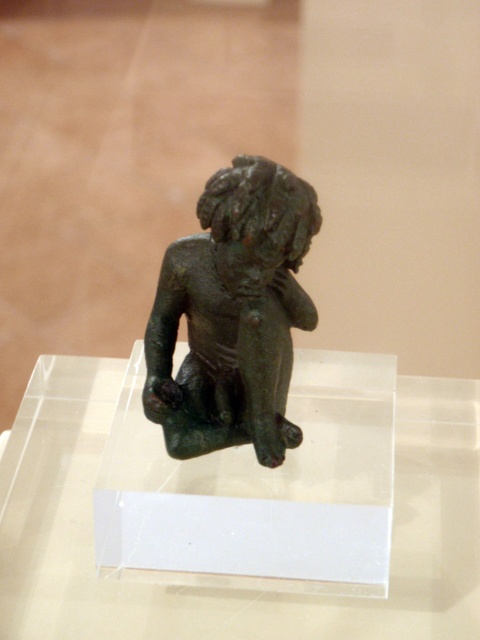
Is transparent acrylic glass table at center positioned in front of bronze statue at center?

No, it is behind bronze statue at center.

Can you confirm if transparent acrylic glass table at center is positioned above bronze statue at center?

No, transparent acrylic glass table at center is not above bronze statue at center.

Where is `transparent acrylic glass table at center`? The width and height of the screenshot is (480, 640). transparent acrylic glass table at center is located at coordinates (219, 588).